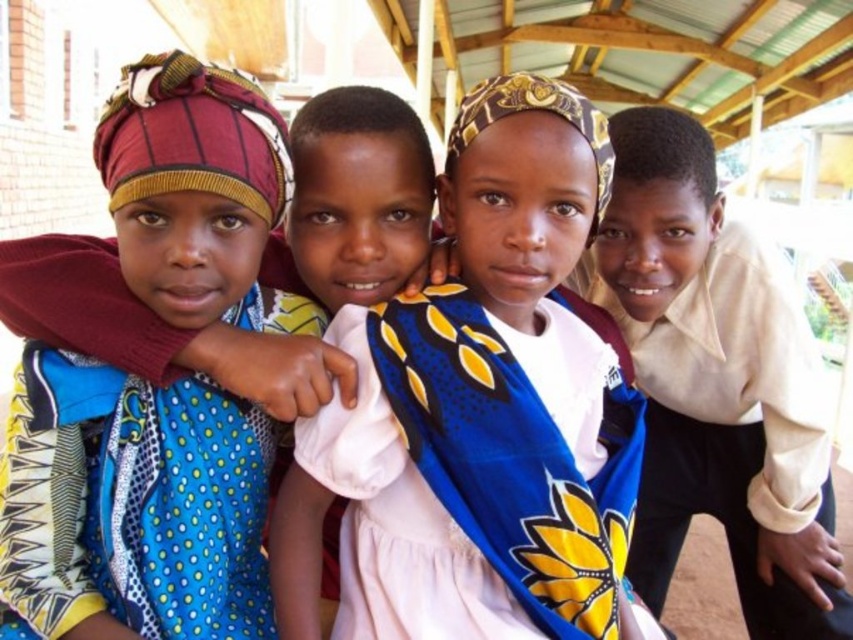
Question: Can you confirm if blue printed fabric at center is positioned below light beige shirt at right?

Choices:
 (A) no
 (B) yes

Answer: (A)

Question: Which point is farther from the camera taking this photo?

Choices:
 (A) (409, 198)
 (B) (544, 212)
 (C) (241, 173)
 (D) (643, 228)

Answer: (D)

Question: Can you confirm if blue printed fabric at center is positioned to the left of light beige shirt at right?

Choices:
 (A) no
 (B) yes

Answer: (B)

Question: Which of the following is the closest to the observer?

Choices:
 (A) (379, 195)
 (B) (378, 472)
 (C) (674, 460)
 (D) (38, 371)

Answer: (D)

Question: In this image, where is blue printed fabric at center located relative to polka dot fabric dress at center?

Choices:
 (A) above
 (B) below

Answer: (B)

Question: Which object is closer to the camera taking this photo?

Choices:
 (A) polka dot fabric dress at center
 (B) yellow printed dress at center

Answer: (A)